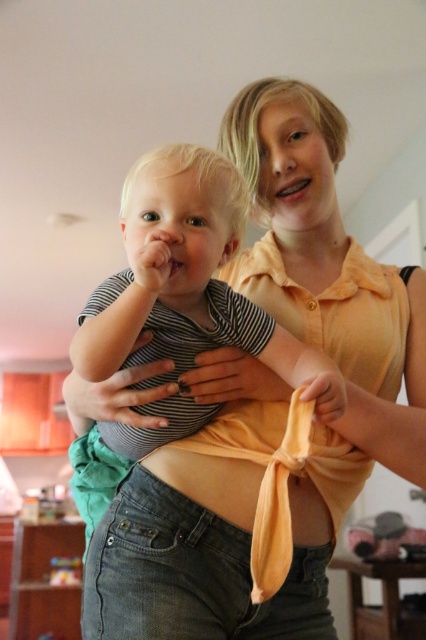
Is striped fabric shirt at center to the right of orange fabric at center from the viewer's perspective?

No, striped fabric shirt at center is not to the right of orange fabric at center.

Does striped fabric shirt at center have a smaller size compared to orange fabric at center?

No.

Is point (169, 221) positioned after point (180, 483)?

No, it is in front of (180, 483).

The height and width of the screenshot is (640, 426). Find the location of `striped fabric shirt at center`. striped fabric shirt at center is located at coordinates (187, 282).